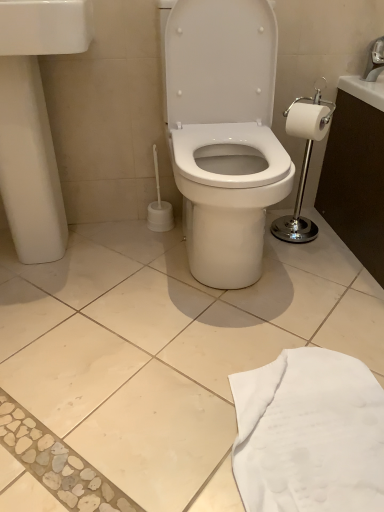
Question: Can you confirm if white glossy toilet paper at right is shorter than white glossy sink at left?

Choices:
 (A) no
 (B) yes

Answer: (B)

Question: Would you say white glossy toilet paper at right is a long distance from white glossy sink at left?

Choices:
 (A) no
 (B) yes

Answer: (A)

Question: From a real-world perspective, is white glossy toilet paper at right beneath white glossy sink at left?

Choices:
 (A) yes
 (B) no

Answer: (B)

Question: Is white glossy toilet paper at right taller than white glossy sink at left?

Choices:
 (A) yes
 (B) no

Answer: (B)

Question: Is white glossy toilet paper at right outside of white glossy sink at left?

Choices:
 (A) yes
 (B) no

Answer: (A)

Question: In the image, is white glossy sink at left positioned in front of or behind white glossy toilet paper at right?

Choices:
 (A) behind
 (B) front

Answer: (B)

Question: Is white glossy sink at left taller or shorter than white glossy toilet paper at right?

Choices:
 (A) tall
 (B) short

Answer: (A)

Question: Is white glossy sink at left to the left or to the right of white glossy toilet paper at right in the image?

Choices:
 (A) right
 (B) left

Answer: (B)

Question: Would you say white glossy sink at left is inside or outside white glossy toilet paper at right?

Choices:
 (A) outside
 (B) inside

Answer: (A)

Question: Considering their positions, is silver metallic faucet at upper right located in front of or behind white fabric at lower right?

Choices:
 (A) front
 (B) behind

Answer: (B)

Question: In terms of height, does silver metallic faucet at upper right look taller or shorter compared to white fabric at lower right?

Choices:
 (A) tall
 (B) short

Answer: (A)

Question: Is silver metallic faucet at upper right inside the boundaries of white fabric at lower right, or outside?

Choices:
 (A) inside
 (B) outside

Answer: (B)

Question: From the image's perspective, relative to white fabric at lower right, is silver metallic faucet at upper right above or below?

Choices:
 (A) below
 (B) above

Answer: (B)

Question: From the image's perspective, is white fabric at lower right located above or below white glossy toilet paper at right?

Choices:
 (A) below
 (B) above

Answer: (A)

Question: Considering the relative positions of white fabric at lower right and white glossy toilet paper at right in the image provided, is white fabric at lower right to the left or to the right of white glossy toilet paper at right?

Choices:
 (A) left
 (B) right

Answer: (A)